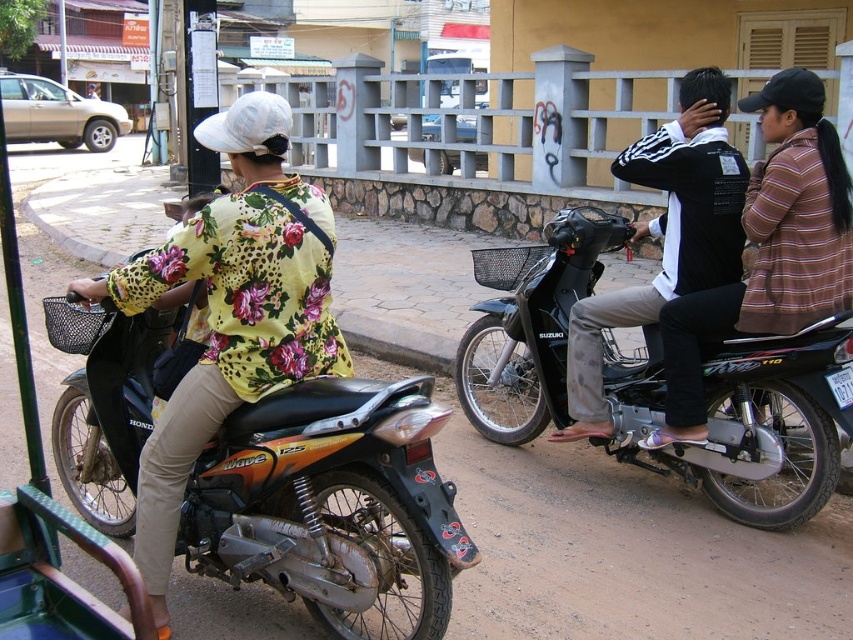
You are a delivery person who needs to pass between the orange matte motorcycle at center and the black matte motorcycle at center. Your delivery cart is 1.5 meters wide. Can you safely navigate through the gap between them?

The distance between the orange matte motorcycle at center and the black matte motorcycle at center is 2.09 meters. Since your delivery cart is 1.5 meters wide, you can safely navigate through the gap as the space is wider than the cart.

In the scene shown: You are a delivery person who needs to choose between the orange matte motorcycle at center and the black matte jacket at center for a delivery route that requires a wider vehicle. Which one should you choose?

The orange matte motorcycle at center has a greater width than the black matte jacket at center, so you should choose the orange matte motorcycle at center for the delivery route that requires a wider vehicle.

You are a pedestrian standing on the sidewalk observing the scene. You see the black matte motorcycle at center and the black matte jacket at center. Which object is positioned more to the left?

The black matte motorcycle at center is positioned to the left of the black matte jacket at center, so it is more to the left.